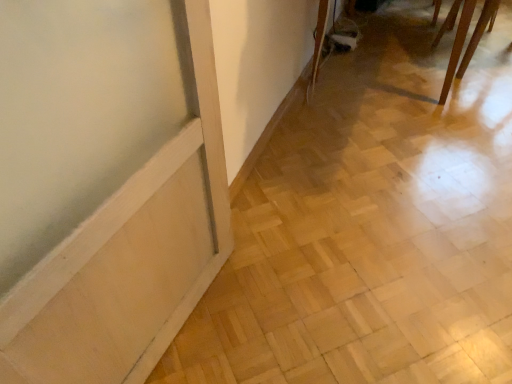
Identify the location of space that is in front of wooden dining table at upper right. The width and height of the screenshot is (512, 384). (482, 94).